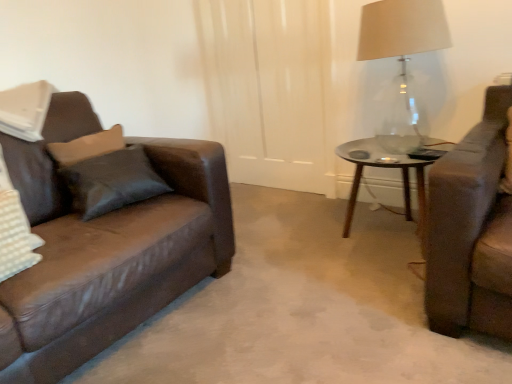
Question: In the image, is clear glass table lamp at upper right positioned in front of or behind transparent glass table at center?

Choices:
 (A) front
 (B) behind

Answer: (A)

Question: Considering the positions of clear glass table lamp at upper right and transparent glass table at center in the image, is clear glass table lamp at upper right wider or thinner than transparent glass table at center?

Choices:
 (A) thin
 (B) wide

Answer: (A)

Question: Is clear glass table lamp at upper right inside the boundaries of transparent glass table at center, or outside?

Choices:
 (A) inside
 (B) outside

Answer: (B)

Question: Is transparent glass table at center bigger or smaller than clear glass table lamp at upper right?

Choices:
 (A) big
 (B) small

Answer: (B)

Question: Is transparent glass table at center wider or thinner than clear glass table lamp at upper right?

Choices:
 (A) thin
 (B) wide

Answer: (B)

Question: From a real-world perspective, relative to clear glass table lamp at upper right, is transparent glass table at center vertically above or below?

Choices:
 (A) below
 (B) above

Answer: (A)

Question: Is transparent glass table at center situated inside clear glass table lamp at upper right or outside?

Choices:
 (A) outside
 (B) inside

Answer: (A)